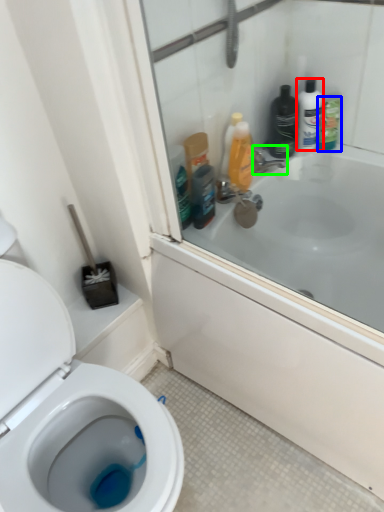
Question: Which object is positioned closest to toiletry (highlighted by a red box)? Select from cleaning product (highlighted by a blue box) and tap (highlighted by a green box).

Choices:
 (A) cleaning product
 (B) tap

Answer: (A)